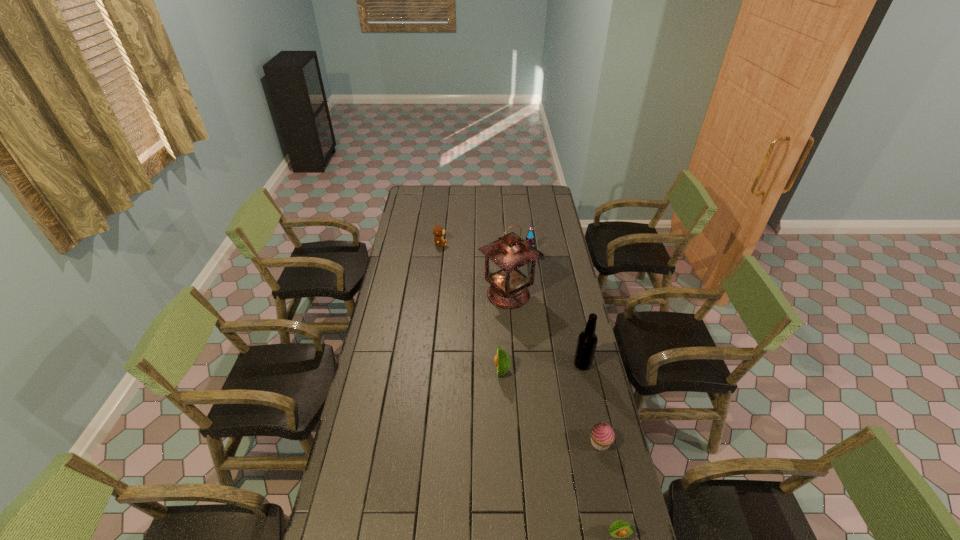
The image size is (960, 540). Identify the location of free space located 0.380m on the cut side of the left avocado. (398, 370).

This screenshot has width=960, height=540. What are the coordinates of `vacant area located on the front of the soda` in the screenshot? It's located at (537, 303).

At what (x,y) coordinates should I click in order to perform the action: click on vacant point located on the face of the leftmost object. Please return your answer as a coordinate pair (x, y). Looking at the image, I should click on (496, 244).

The width and height of the screenshot is (960, 540). What are the coordinates of `vacant position located on the back of the tallest object` in the screenshot? It's located at pos(506,266).

This screenshot has height=540, width=960. I want to click on vacant space located on the left of the second nearest object, so click(568, 442).

You are a GUI agent. You are given a task and a screenshot of the screen. Output one action in this format:
    pyautogui.click(x=<x>, y=<y>)
    Task: Click on the vacant space located 0.190m on the front of the second tallest object
    
    Given the screenshot: What is the action you would take?
    pyautogui.click(x=593, y=414)

Where is `soda situated at the right edge`? soda situated at the right edge is located at coordinates (530, 238).

This screenshot has height=540, width=960. I want to click on cupcake situated at the right edge, so click(602, 435).

Identify the location of beer bottle that is at the right edge. (587, 341).

Locate an element on the screen. free spot at the near edge of the desktop is located at coordinates (546, 523).